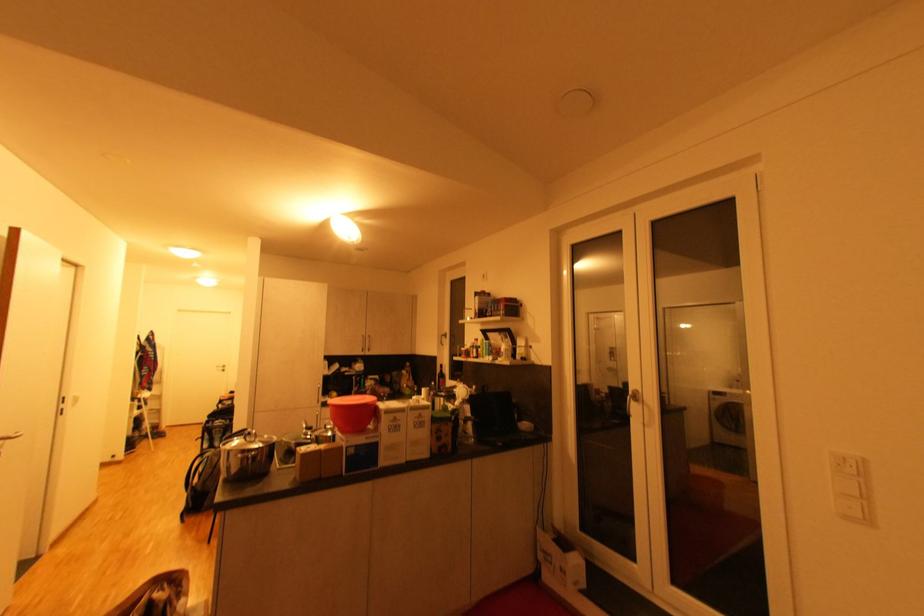
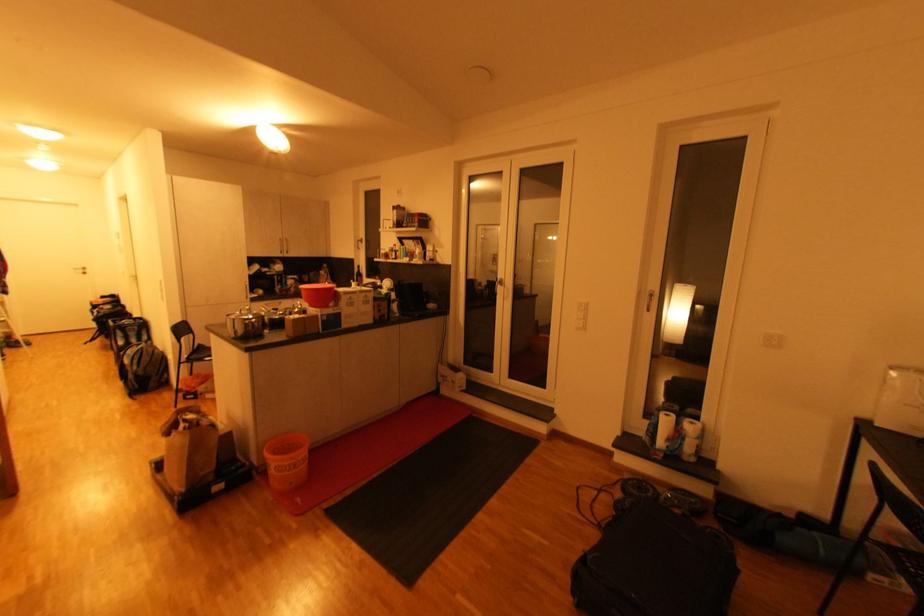
In the second image, find the point that corresponds to point 368,352 in the first image.

(286, 254)